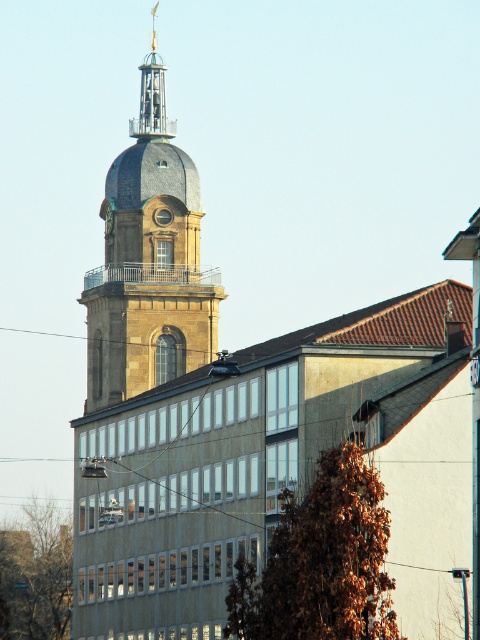
Is golden stone tower at upper center above polished brass clock tower at upper center?

No, golden stone tower at upper center is not above polished brass clock tower at upper center.

Identify the location of golden stone tower at upper center. This screenshot has width=480, height=640. (148, 260).

Where is `golden stone tower at upper center`? This screenshot has width=480, height=640. golden stone tower at upper center is located at coordinates (148, 260).